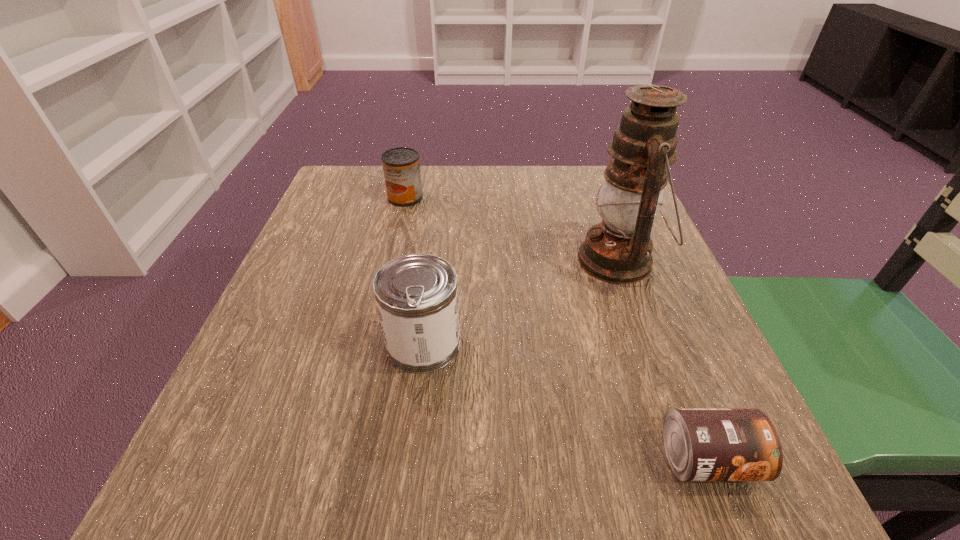
You are a GUI agent. You are given a task and a screenshot of the screen. Output one action in this format:
    pyautogui.click(x=<x>, y=<y>)
    Task: Click on the blank space located on the front of the farthest can
    This screenshot has width=960, height=540.
    Given the screenshot: What is the action you would take?
    pyautogui.click(x=380, y=304)

The height and width of the screenshot is (540, 960). What are the coordinates of `object positioned at the far edge` in the screenshot? It's located at (401, 166).

Identify the location of object situated at the near edge. (702, 444).

This screenshot has height=540, width=960. Find the location of `object present at the left edge`. object present at the left edge is located at coordinates (401, 166).

Image resolution: width=960 pixels, height=540 pixels. I want to click on lantern that is at the right edge, so click(618, 250).

Identify the location of can that is positioned at the right edge. (702, 444).

This screenshot has height=540, width=960. In order to click on object at the far left corner in this screenshot , I will do `click(401, 166)`.

Locate an element on the screen. The height and width of the screenshot is (540, 960). object that is at the near right corner is located at coordinates (702, 444).

Find the location of `vacant region at the far edge of the desktop`. vacant region at the far edge of the desktop is located at coordinates (482, 215).

Identify the location of vacant area at the near edge. This screenshot has width=960, height=540. (544, 469).